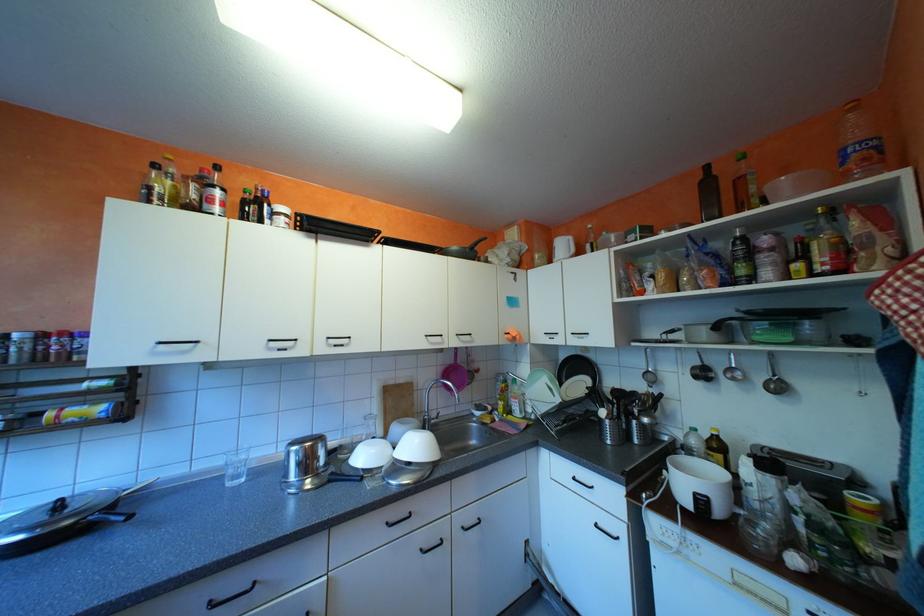
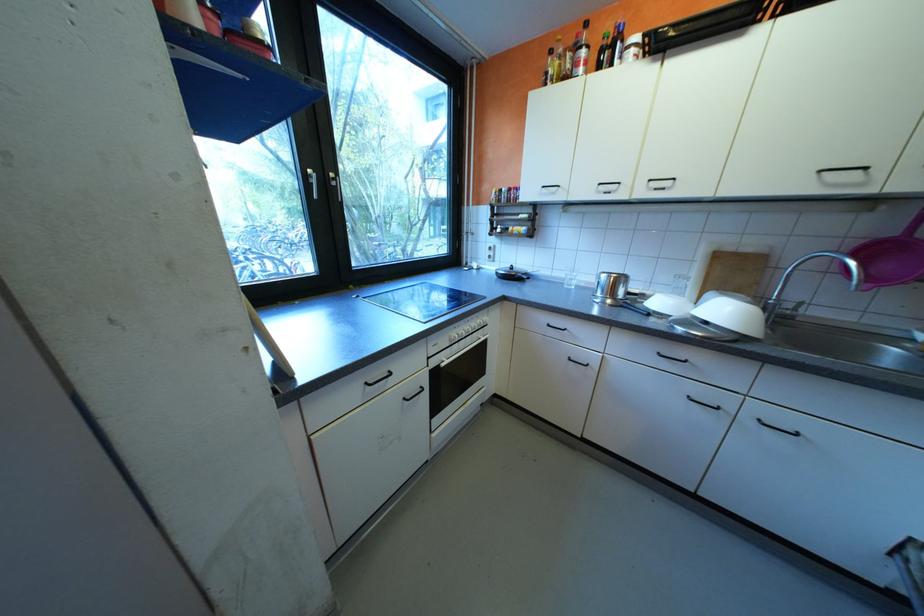
In the second image, find the point that corresponds to (205,195) in the first image.

(580, 65)